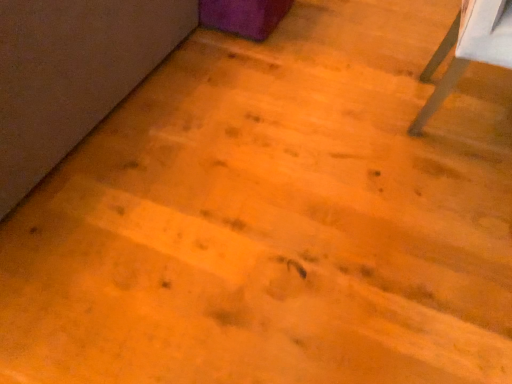
The image size is (512, 384). I want to click on vacant space to the left of wooden table at right, so 345,100.